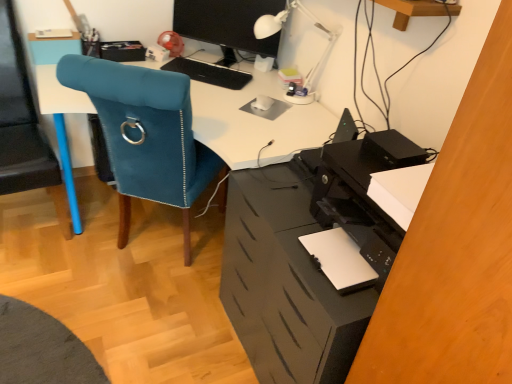
This screenshot has height=384, width=512. In order to click on empty space that is to the right of black matte keyboard at center in this screenshot , I will do (x=257, y=83).